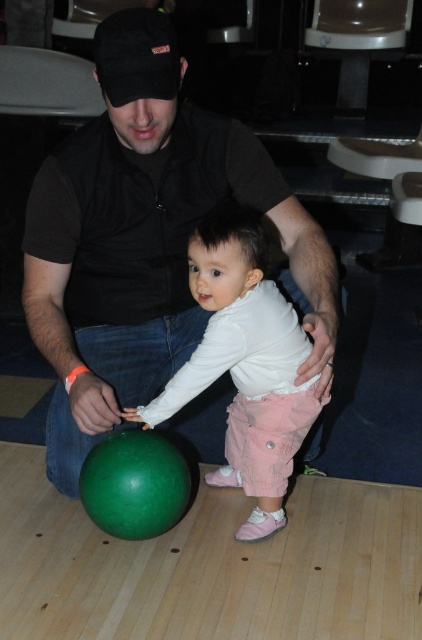
You are standing at the position of the man in the scene. You want to move to the point marked by point (126,289). Which direction should you go relative to point (165,403)?

Point (126,289) is behind point (165,403). So you should move in the direction away from point (165,403) to reach point (126,289).

Which shirt is wider, the black matte shirt at center or the matte white shirt at center?

The black matte shirt at center is wider than the matte white shirt at center according to the description.

You are a photographer standing at the back of the bowling alley. You want to take a photo of the black matte shirt at center and the matte white shirt at center. The minimum distance your camera can focus on two objects is 8 inches. Will both shirts be in focus?

The distance between the black matte shirt at center and the matte white shirt at center is 9.00 inches, which is greater than the camera minimum focusing distance of 8 inches. Therefore, both shirts will be in focus.